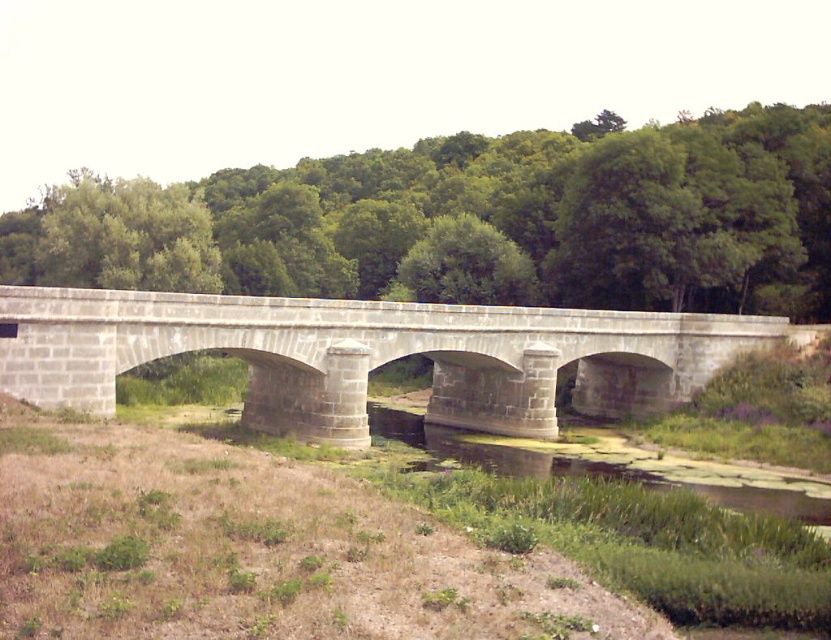
You are standing at the stone bridge and want to take a photo of the green leafy trees at center. If your camera can focus up to 50 meters, will it be able to capture the trees clearly?

The green leafy trees at center are 49.90 meters away from the viewer. Since the camera can focus up to 50 meters, it will be able to capture the trees clearly as the distance is just under the maximum focus range.

You are standing on the stone bridge with three arches and want to point to the exact location of point (x=564, y=212). According to the scene description, where would this point be located?

The point (x=564, y=212) is on green leafy trees at center.